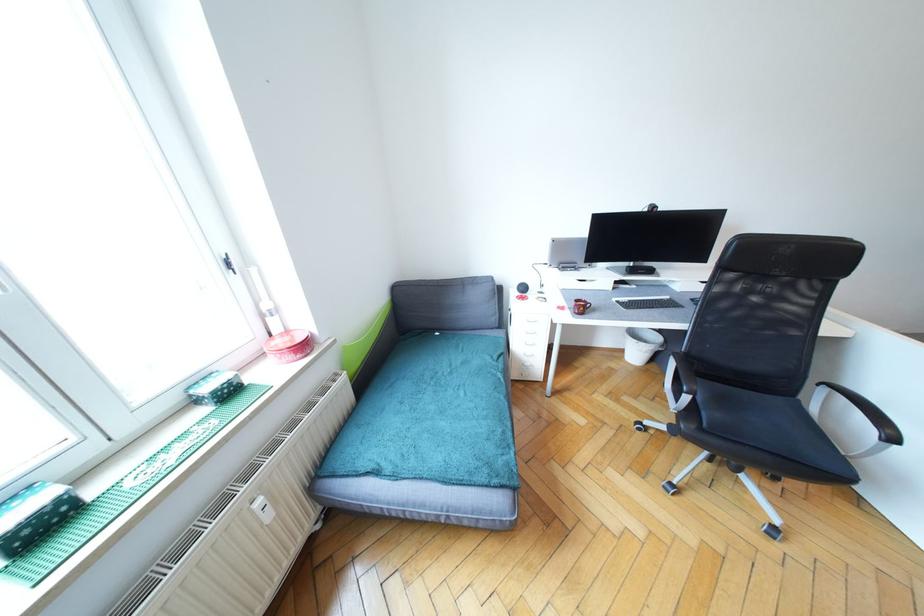
Where would you push the white spray bottle? Please return your answer as a coordinate pair (x, y).

(272, 315)